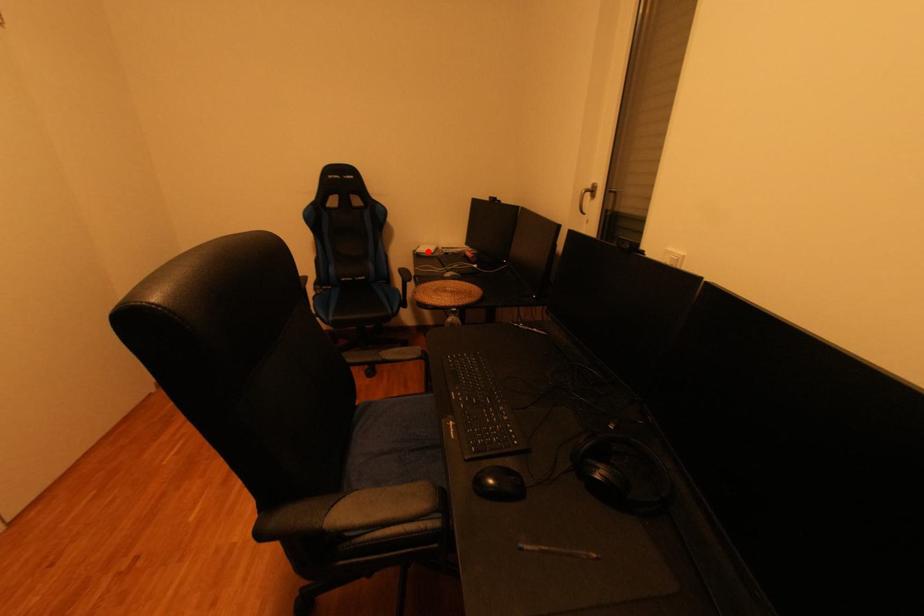
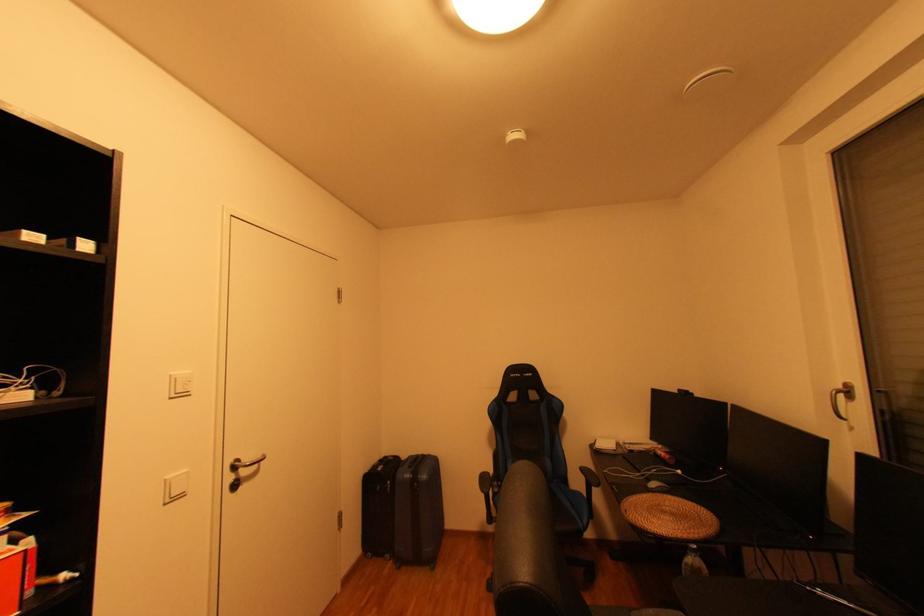
The point at the highlighted location is marked in the first image. Where is the corresponding point in the second image?

(606, 448)